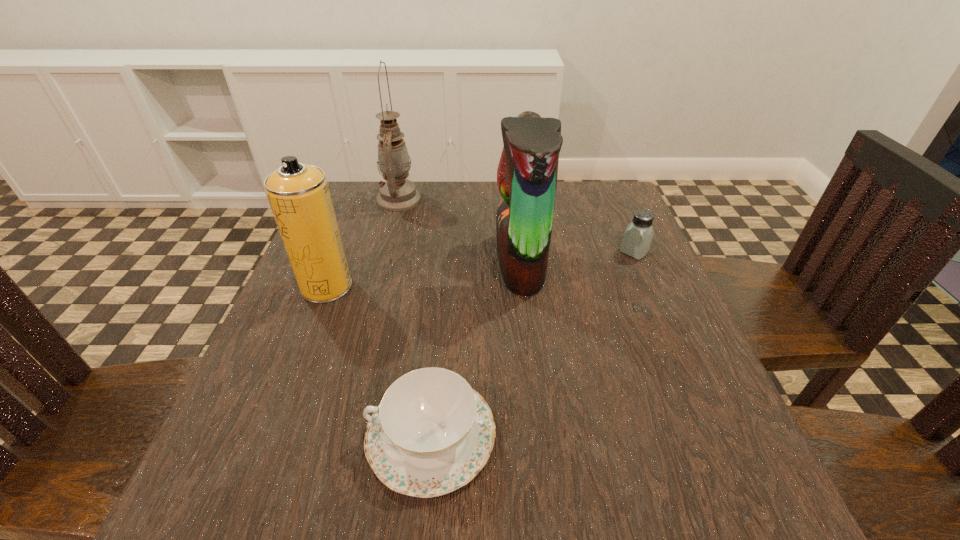
Locate an element on the screen. This screenshot has height=540, width=960. free space between the saltshaker and the shortest object is located at coordinates (533, 343).

At what (x,y) coordinates should I click in order to perform the action: click on blank region between the nearest object and the farthest object. Please return your answer as a coordinate pair (x, y). Looking at the image, I should click on (416, 318).

You are a GUI agent. You are given a task and a screenshot of the screen. Output one action in this format:
    pyautogui.click(x=<x>, y=<y>)
    Task: Click on the blank region between the parrot and the chinaware
    This screenshot has height=540, width=960.
    Given the screenshot: What is the action you would take?
    pyautogui.click(x=476, y=348)

At what (x,y) coordinates should I click in order to perform the action: click on unoccupied area between the aerosol can and the fourth object from left to right. Please return your answer as a coordinate pair (x, y). The image size is (960, 540). Looking at the image, I should click on (423, 274).

Identify the location of vacant area between the nearest object and the oil lamp. This screenshot has height=540, width=960. (416, 318).

Locate an element on the screen. Image resolution: width=960 pixels, height=540 pixels. free space between the parrot and the aerosol can is located at coordinates (423, 274).

Identify the location of empty location between the aerosol can and the farthest object. This screenshot has height=540, width=960. (363, 243).

Locate an element on the screen. Image resolution: width=960 pixels, height=540 pixels. free area in between the saltshaker and the aerosol can is located at coordinates (480, 269).

Locate an element on the screen. The height and width of the screenshot is (540, 960). free spot between the chinaware and the aerosol can is located at coordinates (379, 361).

Where is `empty space between the oil lamp and the parrot`? The image size is (960, 540). empty space between the oil lamp and the parrot is located at coordinates (460, 231).